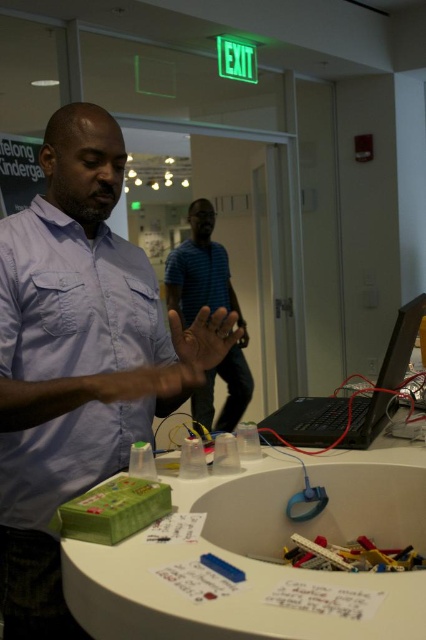
Does white plastic table at center have a larger size compared to blue striped shirt at center?

No, white plastic table at center is not bigger than blue striped shirt at center.

Who is higher up, white plastic table at center or blue striped shirt at center?

blue striped shirt at center is above.

Does point (158, 595) come behind point (213, 296)?

No, (158, 595) is in front of (213, 296).

At what (x,y) coordinates should I click in order to perform the action: click on white plastic table at center. Please return your answer as a coordinate pair (x, y). Looking at the image, I should click on (261, 556).

Is matte blue shirt at left positioned behind blue striped shirt at center?

That is False.

Consider the image. Which of these two, matte blue shirt at left or blue striped shirt at center, stands taller?

With more height is blue striped shirt at center.

Where is `matte blue shirt at left`? matte blue shirt at left is located at coordinates (74, 300).

Between white plastic table at center and matte blue shirt at left, which one has less height?

white plastic table at center is shorter.

Identify the location of white plastic table at center. The width and height of the screenshot is (426, 640). (261, 556).